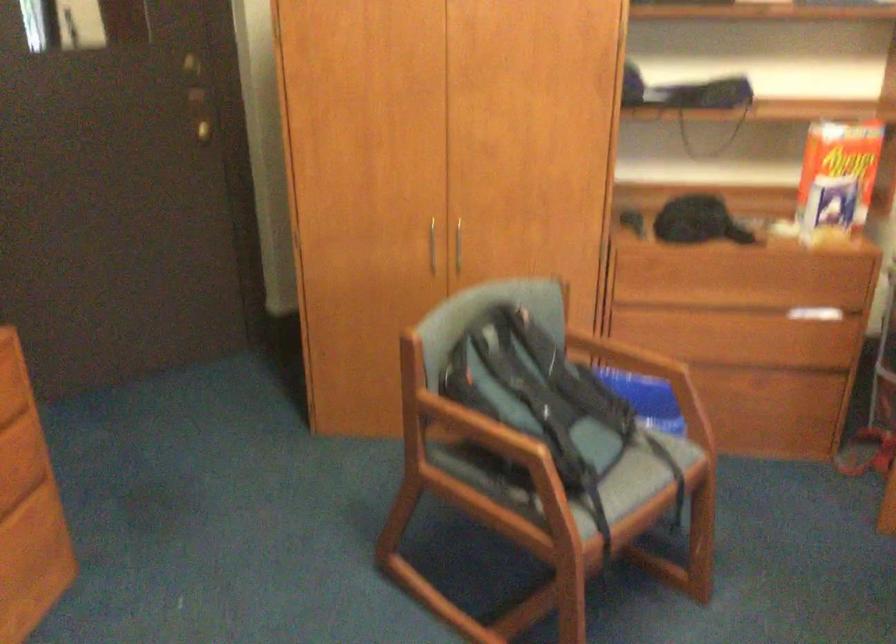
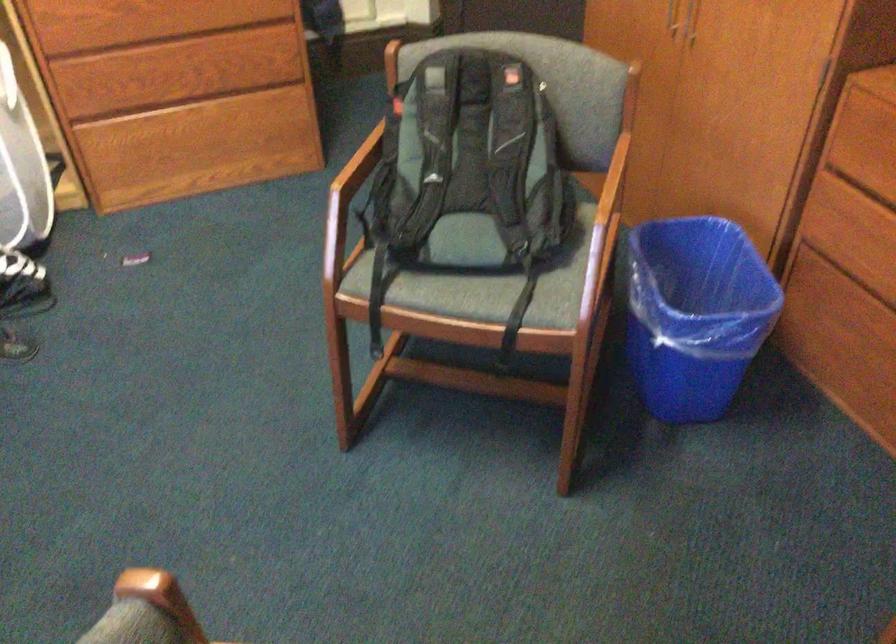
Locate, in the second image, the point that corresponds to (497,451) in the first image.

(350, 183)